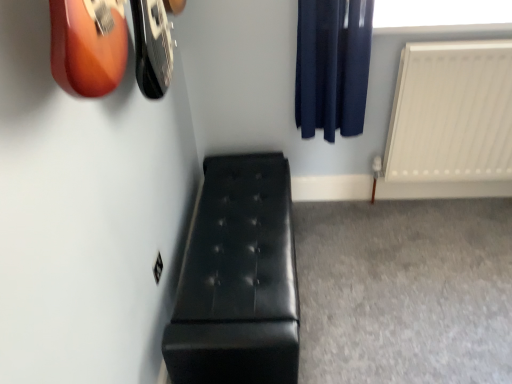
Question: Considering their positions, is black leather bench at lower left located in front of or behind white matte radiator at right?

Choices:
 (A) front
 (B) behind

Answer: (A)

Question: In terms of size, does black leather bench at lower left appear bigger or smaller than white matte radiator at right?

Choices:
 (A) small
 (B) big

Answer: (B)

Question: Which is farther from the dark blue fabric curtain at upper right?

Choices:
 (A) white matte radiator at right
 (B) black leather bench at lower left
 (C) transparent plastic window screen at upper right

Answer: (B)

Question: Which object is positioned farthest from the dark blue fabric curtain at upper right?

Choices:
 (A) black leather bench at lower left
 (B) transparent plastic window screen at upper right
 (C) white matte radiator at right

Answer: (A)